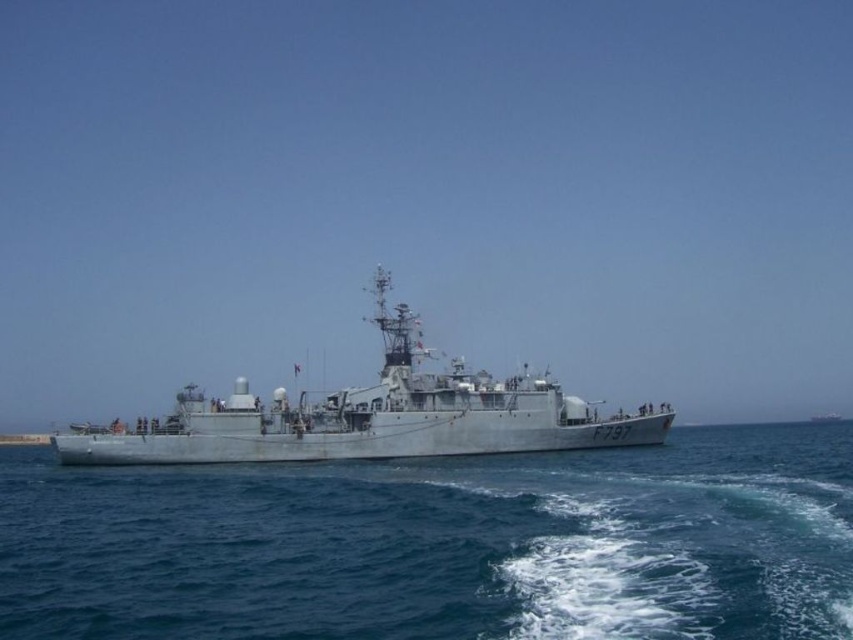
Question: Which point appears farthest from the camera in this image?

Choices:
 (A) (641, 621)
 (B) (264, 406)

Answer: (B)

Question: Can you confirm if blue water at center is positioned to the right of gray metallic ship at center?

Choices:
 (A) yes
 (B) no

Answer: (A)

Question: Is blue water at center wider than gray metallic ship at center?

Choices:
 (A) no
 (B) yes

Answer: (B)

Question: Is blue water at center below gray metallic ship at center?

Choices:
 (A) no
 (B) yes

Answer: (B)